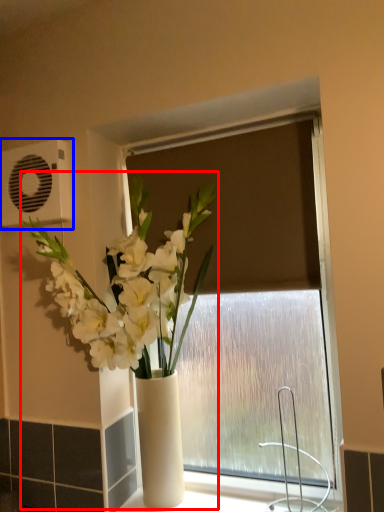
Question: Among these objects, which one is nearest to the camera, houseplant (highlighted by a red box) or air conditioning (highlighted by a blue box)?

Choices:
 (A) houseplant
 (B) air conditioning

Answer: (A)